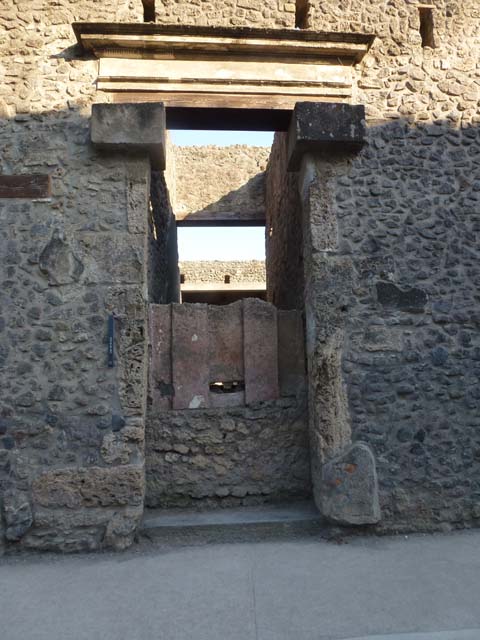
I want to click on left wall of opening, so click(x=164, y=256).